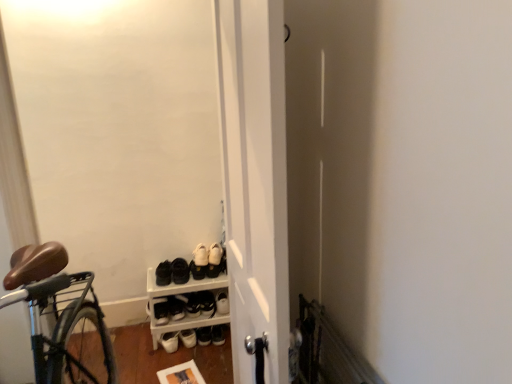
Question: Considering the relative positions of white plastic shoe rack at lower center and black leather shoe at center, which ranks as the 2th footwear in right-to-left order, in the image provided, is white plastic shoe rack at lower center to the left or to the right of black leather shoe at center, which ranks as the 2th footwear in right-to-left order,?

Choices:
 (A) right
 (B) left

Answer: (B)

Question: In terms of size, does white plastic shoe rack at lower center appear bigger or smaller than black leather shoe at center, which ranks as the 2th footwear in right-to-left order?

Choices:
 (A) big
 (B) small

Answer: (A)

Question: Estimate the real-world distances between objects in this image. Which object is farther from the white matte door at center?

Choices:
 (A) white suede shoes at lower center, marked as the 3th footwear in a left-to-right arrangement
 (B) metallic silver radiator at lower right
 (C) white suede shoes at center, the fifth footwear from the left
 (D) black leather shoe at center, arranged as the 4th footwear when viewed from the left
 (E) black matte sneakers at lower left, which is the fifth footwear in right-to-left order

Answer: (D)

Question: Which of these objects is positioned closest to the black leather shoe at center, which ranks as the 2th footwear in right-to-left order?

Choices:
 (A) black matte sneakers at lower left, which is the fifth footwear in right-to-left order
 (B) white plastic shoe rack at lower center
 (C) white matte door at center
 (D) black matte shoes at center, arranged as the 2th footwear when viewed from the left
 (E) white suede shoes at center, the fifth footwear from the left

Answer: (B)